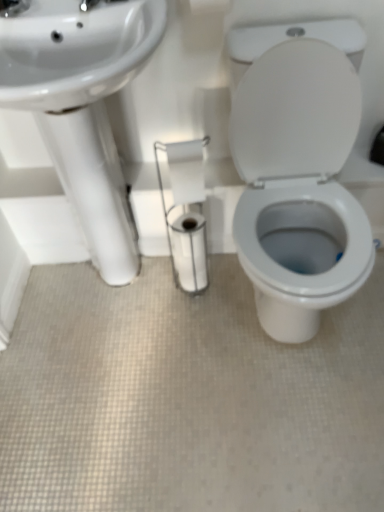
Question: Is white glossy toilet paper at center, the 1th toilet paper positioned from the bottom, facing away from white glossy porcelain at center?

Choices:
 (A) yes
 (B) no

Answer: (B)

Question: Is white glossy toilet paper at center, the 1th toilet paper positioned from the bottom, to the right of white glossy porcelain at center from the viewer's perspective?

Choices:
 (A) yes
 (B) no

Answer: (B)

Question: Is white glossy toilet paper at center, the 1th toilet paper positioned from the bottom, positioned beyond the bounds of white glossy porcelain at center?

Choices:
 (A) no
 (B) yes

Answer: (B)

Question: Is white glossy toilet paper at center, the 1th toilet paper positioned from the bottom, behind white glossy porcelain at center?

Choices:
 (A) no
 (B) yes

Answer: (B)

Question: Is white glossy toilet paper at center, the 1th toilet paper positioned from the bottom, wider than white glossy porcelain at center?

Choices:
 (A) no
 (B) yes

Answer: (A)

Question: Considering their positions, is white glossy toilet paper at center, the 1th toilet paper positioned from the bottom, located in front of or behind white matte toilet paper at upper center, the 1th toilet paper when ordered from top to bottom?

Choices:
 (A) behind
 (B) front

Answer: (A)

Question: In terms of width, does white glossy toilet paper at center, the 1th toilet paper positioned from the bottom, look wider or thinner when compared to white matte toilet paper at upper center, the 1th toilet paper when ordered from top to bottom?

Choices:
 (A) wide
 (B) thin

Answer: (B)

Question: Is white glossy toilet paper at center, which ranks as the 2th toilet paper in top-to-bottom order, to the left or to the right of white matte toilet paper at upper center, the 1th toilet paper when ordered from top to bottom, in the image?

Choices:
 (A) left
 (B) right

Answer: (A)

Question: In terms of size, does white glossy toilet paper at center, which ranks as the 2th toilet paper in top-to-bottom order, appear bigger or smaller than white matte toilet paper at upper center, which appears as the second toilet paper when ordered from the bottom?

Choices:
 (A) small
 (B) big

Answer: (A)

Question: Is white matte toilet paper at upper center, the 1th toilet paper when ordered from top to bottom, to the left or to the right of white glossy sink at left in the image?

Choices:
 (A) left
 (B) right

Answer: (B)

Question: Would you say white matte toilet paper at upper center, which appears as the second toilet paper when ordered from the bottom, is inside or outside white glossy sink at left?

Choices:
 (A) inside
 (B) outside

Answer: (B)

Question: From a real-world perspective, is white matte toilet paper at upper center, the 1th toilet paper when ordered from top to bottom, physically located above or below white glossy sink at left?

Choices:
 (A) above
 (B) below

Answer: (A)

Question: From the image's perspective, is white matte toilet paper at upper center, which appears as the second toilet paper when ordered from the bottom, above or below white glossy sink at left?

Choices:
 (A) below
 (B) above

Answer: (B)

Question: From a real-world perspective, is white glossy toilet paper at center, which ranks as the 2th toilet paper in top-to-bottom order, physically located above or below white glossy sink at left?

Choices:
 (A) above
 (B) below

Answer: (A)

Question: Based on their positions, is white glossy toilet paper at center, which ranks as the 2th toilet paper in top-to-bottom order, located to the left or right of white glossy sink at left?

Choices:
 (A) left
 (B) right

Answer: (B)